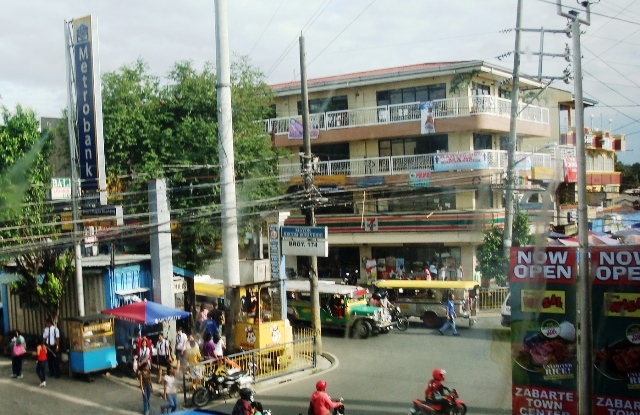
The width and height of the screenshot is (640, 415). I want to click on wires, so click(x=356, y=199).